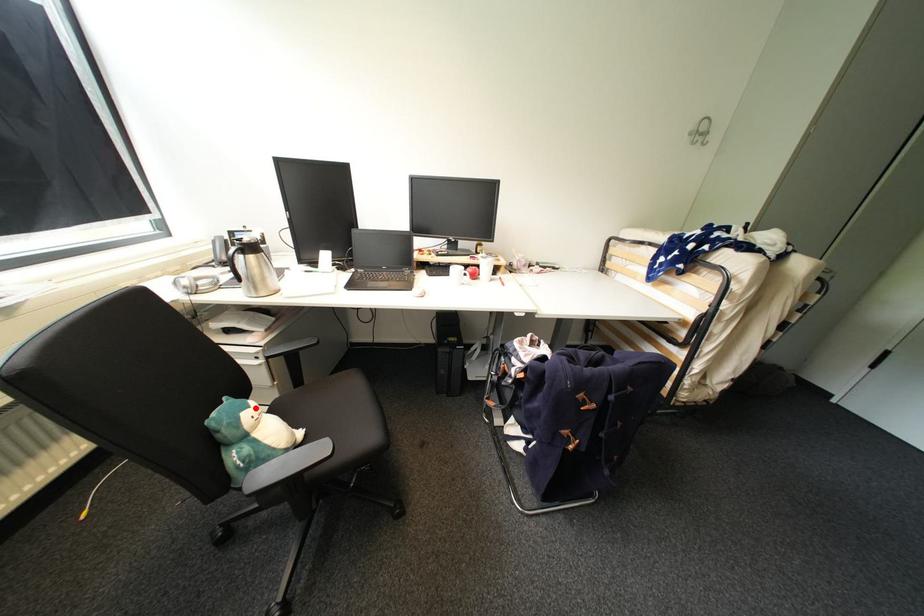
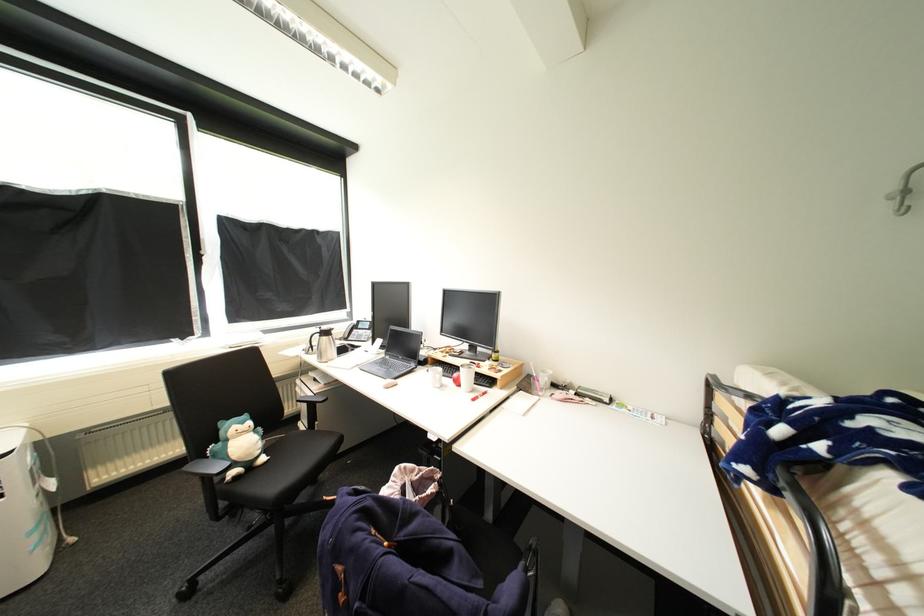
Question: I am providing you with two images of the same scene from different viewpoints. Image1 has a red point marked. In image2, the corresponding 3D location appears at what relative position? Reply with the corresponding letter.

Choices:
 (A) Closer
 (B) Farther

Answer: (B)